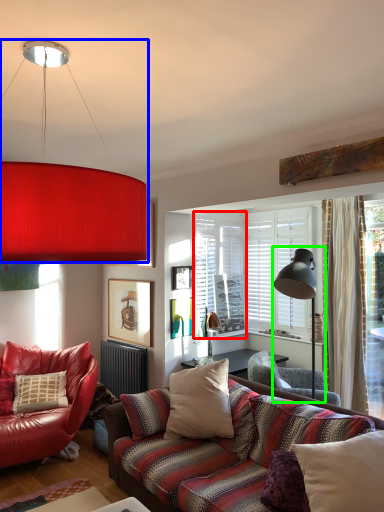
Question: Considering the real-world distances, which object is farthest from window screen (highlighted by a red box)? lamp (highlighted by a blue box) or table lamp (highlighted by a green box)?

Choices:
 (A) lamp
 (B) table lamp

Answer: (A)